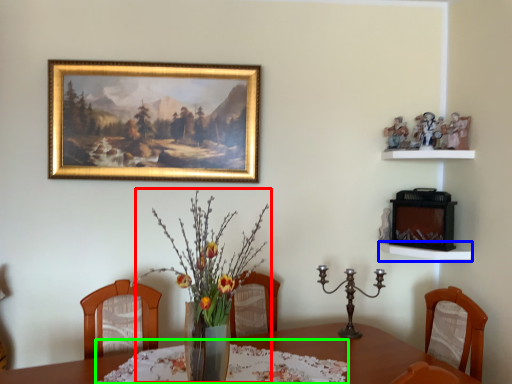
Question: Considering the real-world distances, which object is closest to floral arrangement (highlighted by a red box)? shelf (highlighted by a blue box) or tablecloth (highlighted by a green box).

Choices:
 (A) shelf
 (B) tablecloth

Answer: (B)